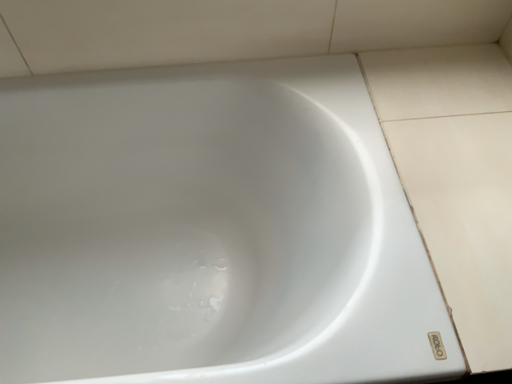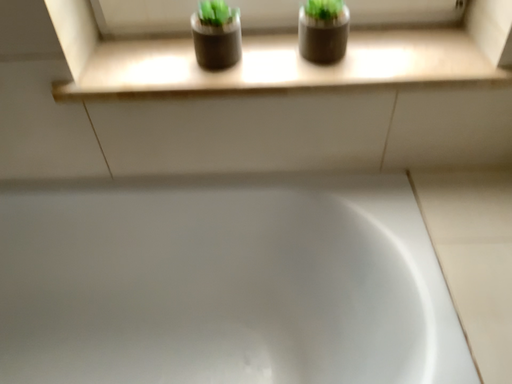
Question: How did the camera likely rotate when shooting the video?

Choices:
 (A) rotated downward
 (B) rotated upward

Answer: (B)